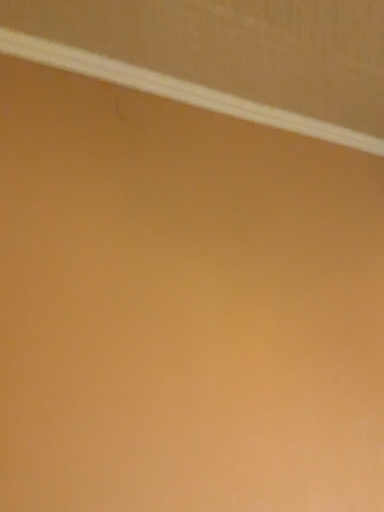
In order to face white matte trim at upper left, should I rotate leftwards or rightwards?

Turn right by 12.989 degrees to look at white matte trim at upper left.

The image size is (384, 512). I want to click on white matte trim at upper left, so click(x=179, y=90).

Measure the distance between white matte trim at upper left and camera.

They are 96.37 centimeters apart.

What do you see at coordinates (179, 90) in the screenshot? The width and height of the screenshot is (384, 512). I see `white matte trim at upper left` at bounding box center [179, 90].

At what (x,y) coordinates should I click in order to perform the action: click on white matte trim at upper left. Please return your answer as a coordinate pair (x, y). Image resolution: width=384 pixels, height=512 pixels. Looking at the image, I should click on (179, 90).